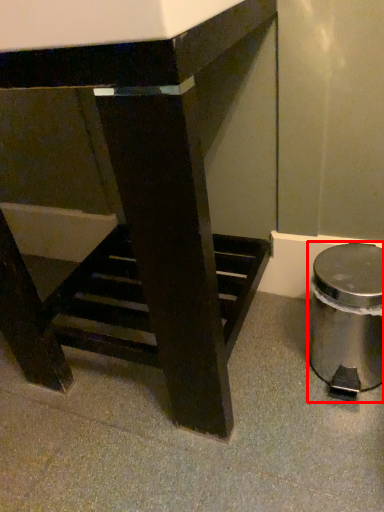
Question: Considering the relative positions of waste container (annotated by the red box) and table in the image provided, where is waste container (annotated by the red box) located with respect to the staircase?

Choices:
 (A) right
 (B) left

Answer: (A)